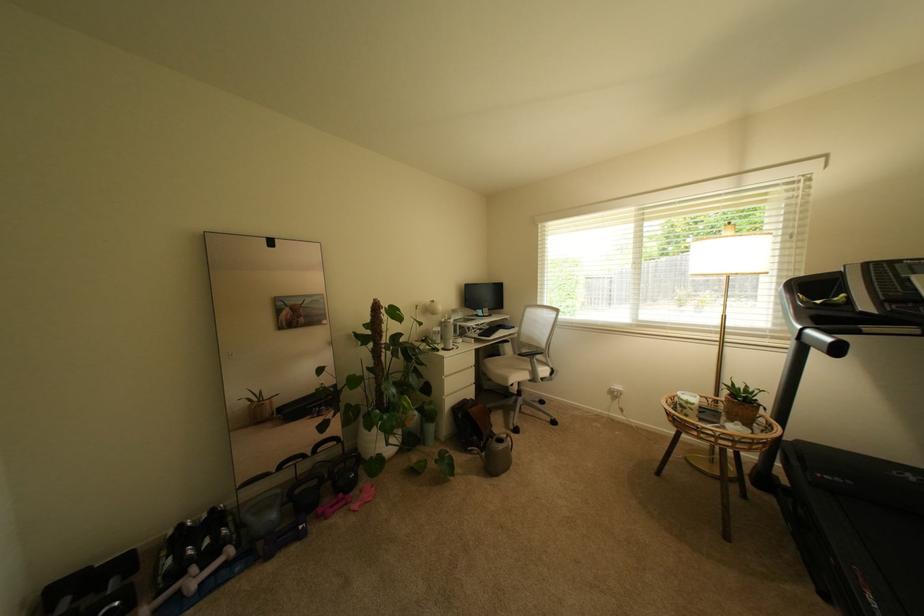
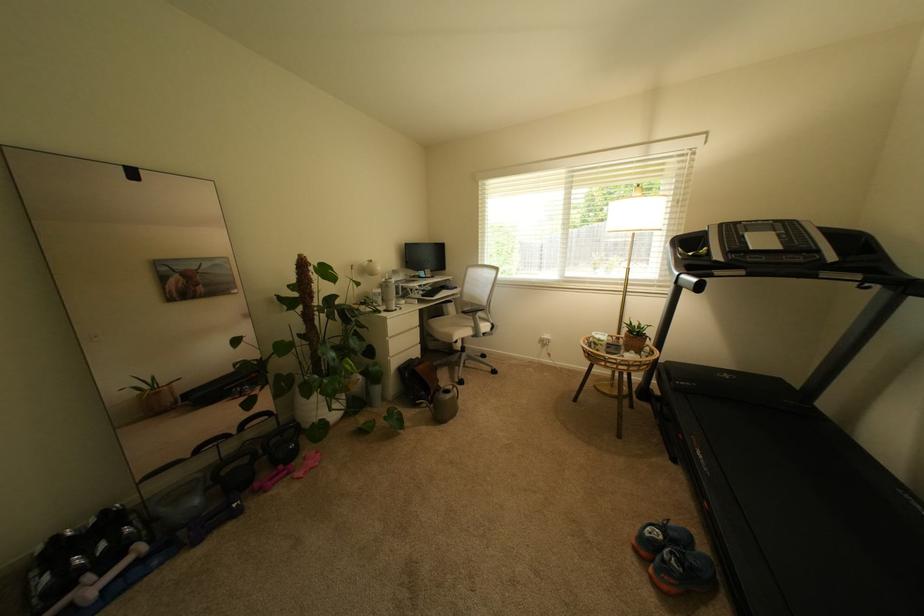
In the second image, find the point that corresponds to [451,347] in the first image.

(393, 310)